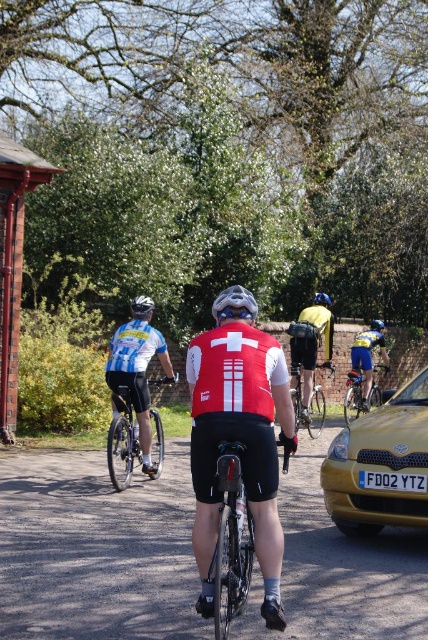
You are a photographer trying to capture a clear photo of the shiny black bicycle at center and the white matte bicycle helmet at center. Based on their sizes in the image, which one would be harder to focus on due to its smaller size?

The shiny black bicycle at center occupies less space than the white matte bicycle helmet at center, so it would be harder to focus on due to its smaller size.

You are a photographer standing at the starting line of the race. You want to take a photo that includes both the yellow fabric backpack at center and the blue matte bicycle helmet at center. What is the minimum distance you need to move forward or backward to ensure both are in frame?

The yellow fabric backpack at center and blue matte bicycle helmet at center are 2.34 meters apart. To include both in the photo, you need to position yourself so that the distance between them fits within your camera frame. Since they are already at the center, adjusting your position slightly forward or backward by approximately 1 meter might help, but the exact distance depends on your camera lens and focal length.

You are a photographer trying to capture a clear photo of the black plastic license plate at center and the matte gray bicycle helmet at center. Since the license plate is smaller, which object should you zoom in on more to get a detailed shot?

The black plastic license plate at center has a smaller size compared to the matte gray bicycle helmet at center, so you should zoom in more on the black plastic license plate at center to capture its details clearly.